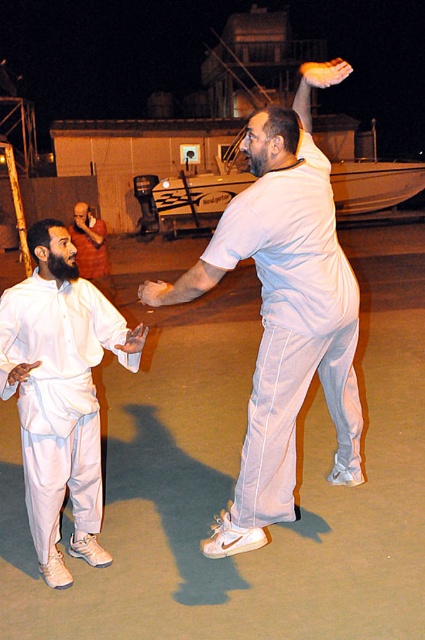
Question: Can you confirm if white matte pants at left is positioned above smooth golden hand at upper center?

Choices:
 (A) no
 (B) yes

Answer: (A)

Question: Which point is farther from the camera taking this photo?

Choices:
 (A) (68, 458)
 (B) (337, 166)
 (C) (328, 237)

Answer: (B)

Question: Which of the following is the closest to the observer?

Choices:
 (A) (150, 292)
 (B) (316, 72)
 (C) (263, 440)

Answer: (C)

Question: Which of these objects is positioned farthest from the smooth golden hand at upper center?

Choices:
 (A) matte white hand at center
 (B) white matte pants at center

Answer: (A)

Question: Is matte white shirt at center closer to camera compared to matte white hand at center?

Choices:
 (A) no
 (B) yes

Answer: (A)

Question: Is white fiberglass boat at center smaller than matte white shirt at center?

Choices:
 (A) yes
 (B) no

Answer: (A)